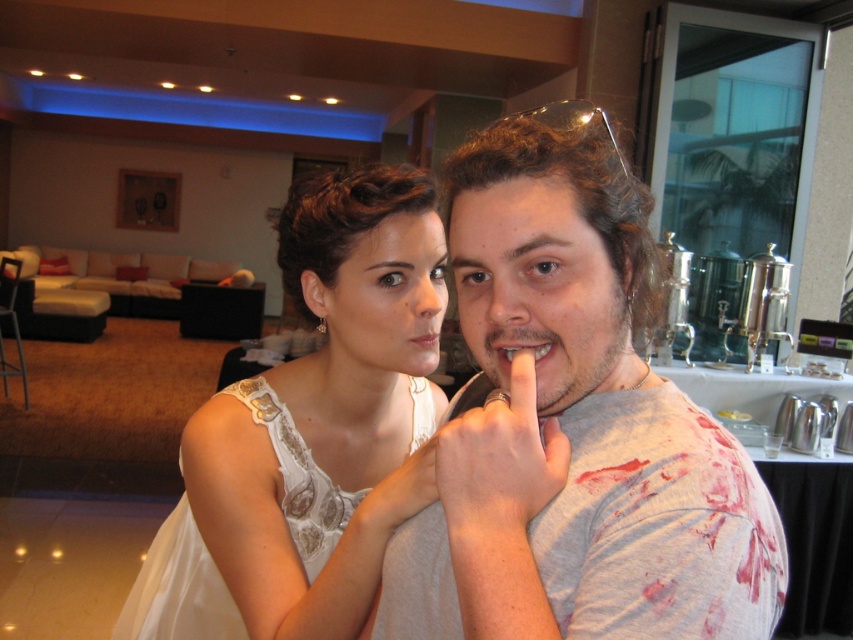
Question: Which point is closer to the camera?

Choices:
 (A) (514, 502)
 (B) (415, 275)

Answer: (A)

Question: Can you confirm if gray cotton t-shirt at center is smaller than white lace dress at center?

Choices:
 (A) no
 (B) yes

Answer: (B)

Question: Does gray cotton t-shirt at center have a greater width compared to white fabric hand at center?

Choices:
 (A) no
 (B) yes

Answer: (B)

Question: Which point is closer to the camera?

Choices:
 (A) matte white teeth at center
 (B) white fabric hand at center
 (C) gray cotton t-shirt at center

Answer: (C)

Question: Estimate the real-world distances between objects in this image. Which object is farther from the gray cotton t-shirt at center?

Choices:
 (A) matte white teeth at center
 (B) white lace dress at center
 (C) matte pink lips at center

Answer: (C)

Question: Where is white fabric hand at center located in relation to matte white teeth at center in the image?

Choices:
 (A) above
 (B) below

Answer: (B)